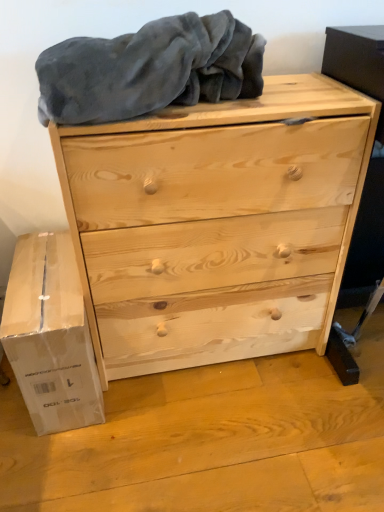
Find the location of a particular element. The image size is (384, 512). vacant area in front of natural wood chest of drawers at center is located at coordinates (206, 443).